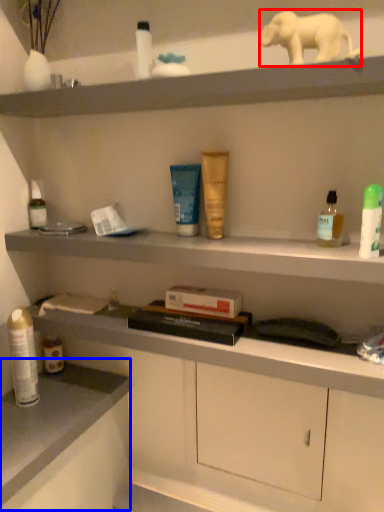
Question: Which object appears farthest to the camera in this image, elephant (highlighted by a red box) or counter top (highlighted by a blue box)?

Choices:
 (A) elephant
 (B) counter top

Answer: (B)